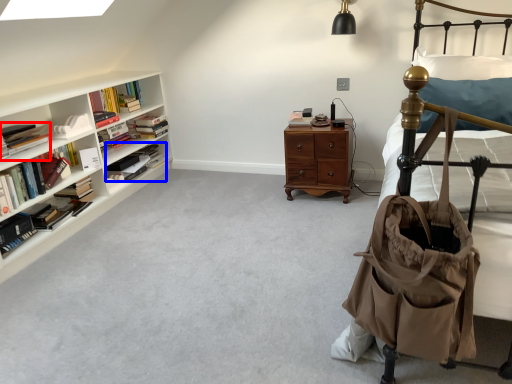
Question: Which of the following is the closest to the observer, book (highlighted by a red box) or book (highlighted by a blue box)?

Choices:
 (A) book
 (B) book

Answer: (A)